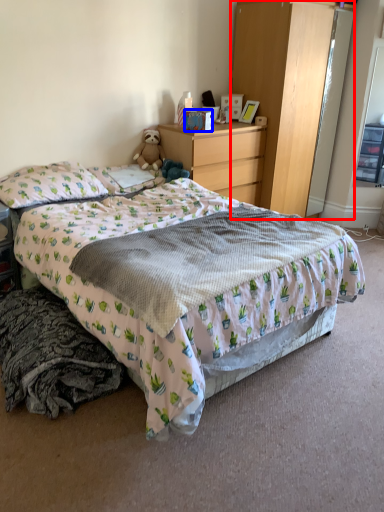
Question: Among these objects, which one is farthest to the camera, cabinetry (highlighted by a red box) or box (highlighted by a blue box)?

Choices:
 (A) cabinetry
 (B) box

Answer: (B)